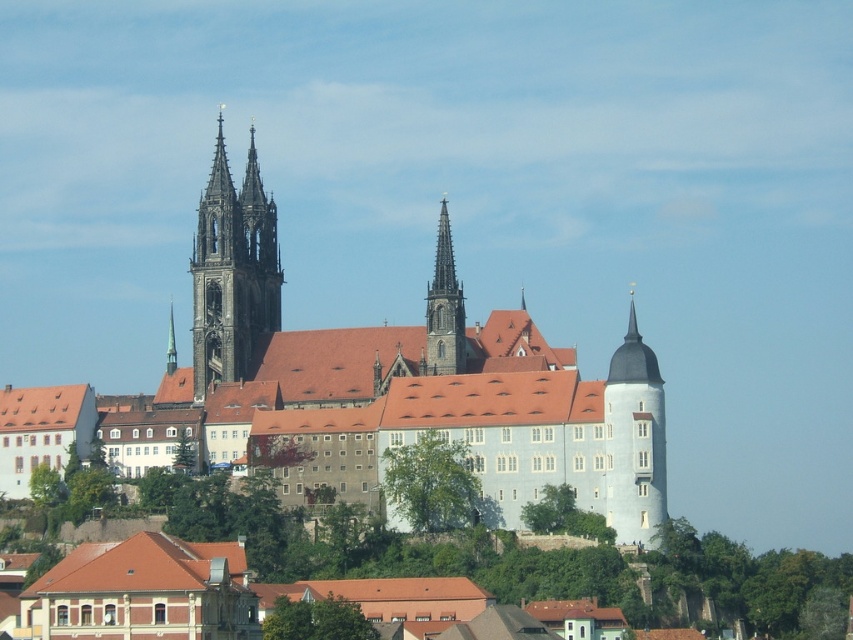
You are a tourist standing at the base of the hill looking up at the castle. You notice the white stone tower at right and the smooth gray stone spire at center. Which one do you see towering higher above the others?

The white stone tower at right is much taller than the smooth gray stone spire at center, so you see it towering higher above the others.

You are standing at the base of the hill looking up at the castle. Which object is positioned to the left of the other between the smooth stone church at center and the smooth gray stone spire at center?

The smooth stone church at center is to the left of the smooth gray stone spire at center.

You are standing at the base of the hill looking up at the castle. You want to take a photo that includes both the white stone tower at right and the smooth gray stone spire at center. Which object should you position closer to the front of your photo frame to ensure both are visible?

To ensure both the white stone tower at right and the smooth gray stone spire at center are visible in your photo, position the white stone tower at right closer to the front of your photo frame since it is in front of the smooth gray stone spire at center.